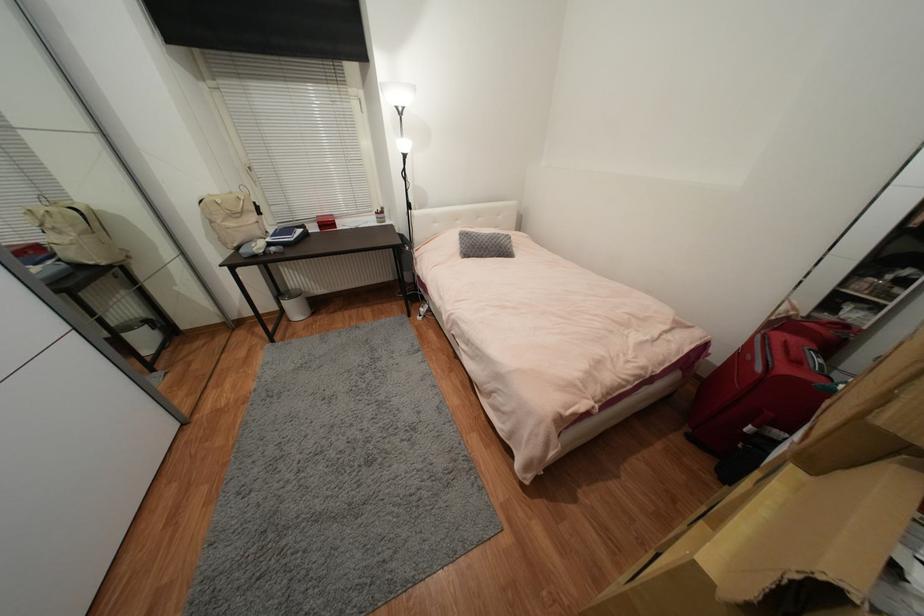
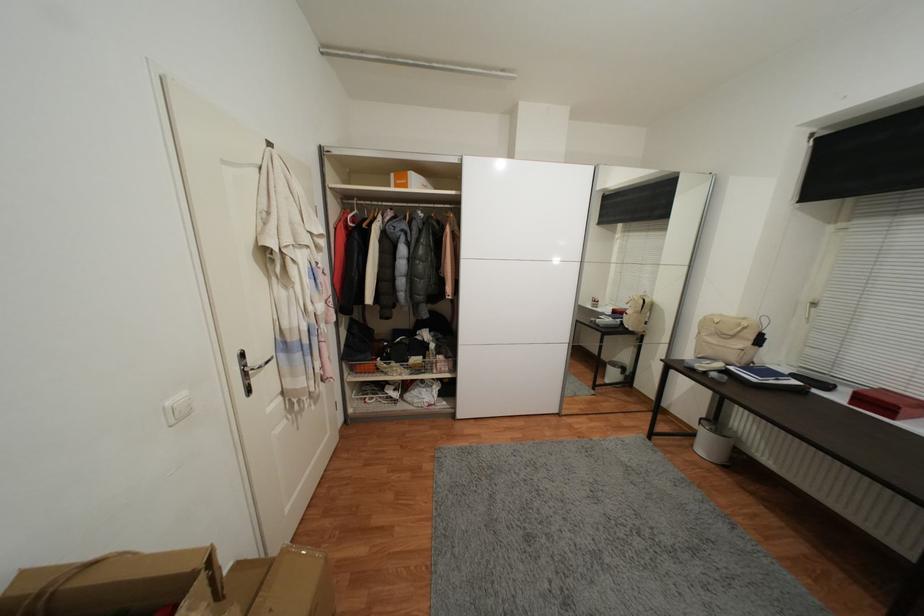
From the picture: First-person continuous shooting, in which direction is the camera rotating?

The camera rotated toward left-down.